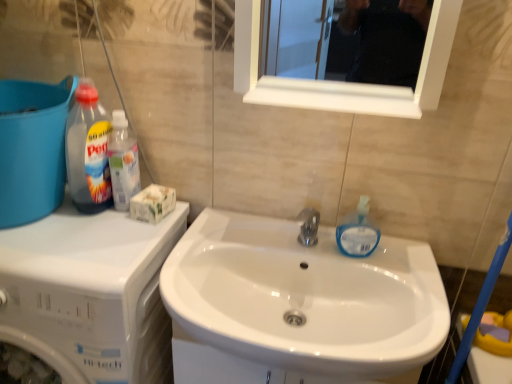
Identify the location of free space in front of transparent plastic bottle at left, which ranks as the 1th cleaning product in left-to-right order. This screenshot has height=384, width=512. (61, 227).